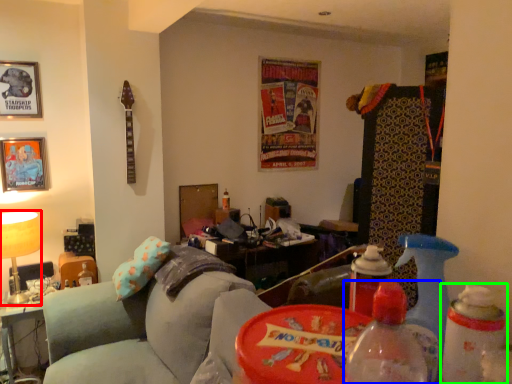
Question: Which object is the farthest from table lamp (highlighted by a red box)? Choose among these: bottle (highlighted by a blue box) or bottle (highlighted by a green box).

Choices:
 (A) bottle
 (B) bottle

Answer: (B)